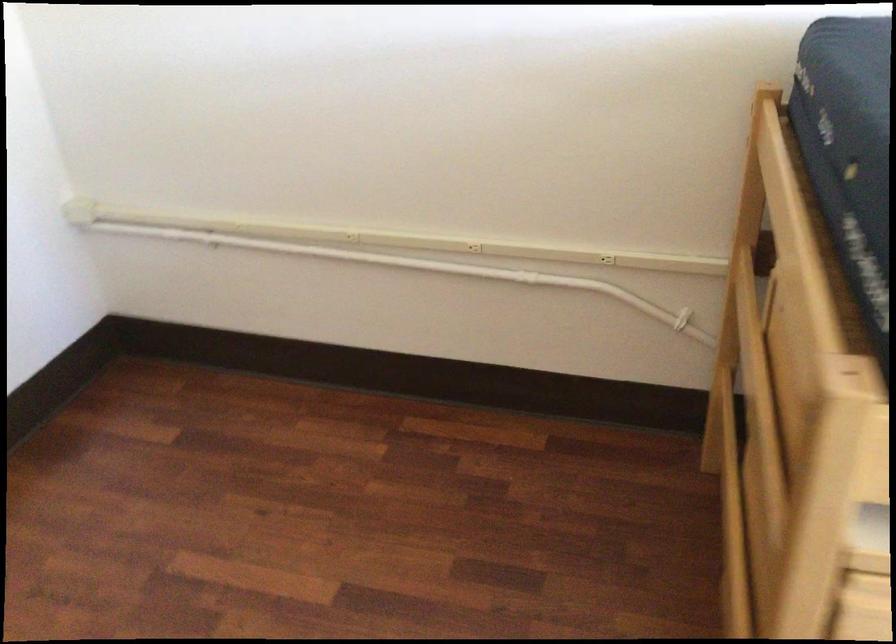
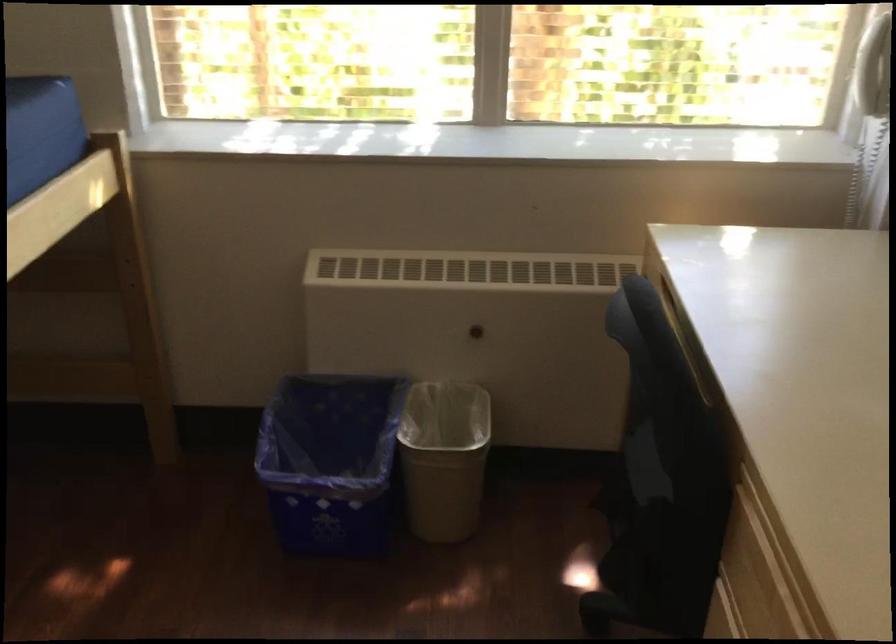
Looking at this image, how did the camera likely rotate?

The camera rotated toward right-down.